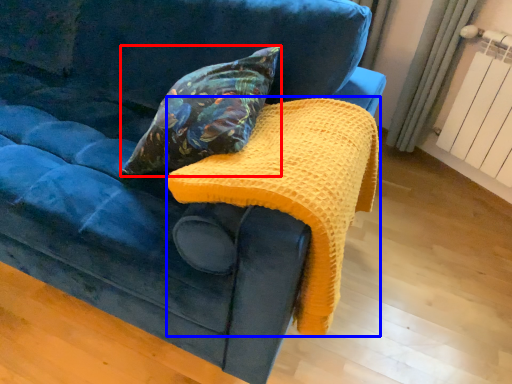
Question: Which point is further to the camera, pillow (highlighted by a red box) or blanket (highlighted by a blue box)?

Choices:
 (A) pillow
 (B) blanket

Answer: (A)